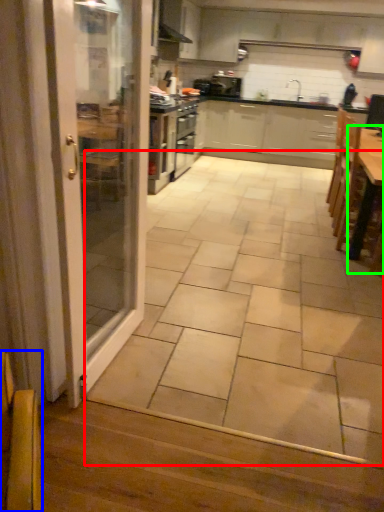
Question: Estimate the real-world distances between objects in this image. Which object is farther from ceramic tile (highlighted by a red box), armchair (highlighted by a blue box) or table (highlighted by a green box)?

Choices:
 (A) armchair
 (B) table

Answer: (A)